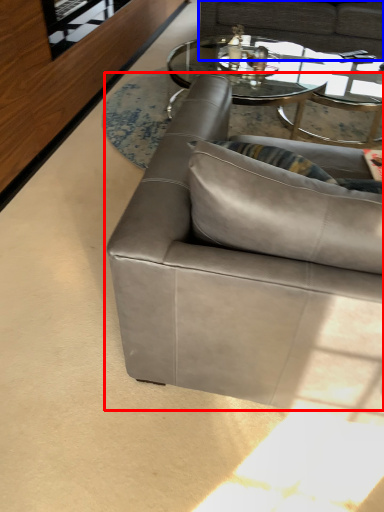
Question: Which of the following is the farthest to the observer, studio couch (highlighted by a red box) or studio couch (highlighted by a blue box)?

Choices:
 (A) studio couch
 (B) studio couch

Answer: (B)